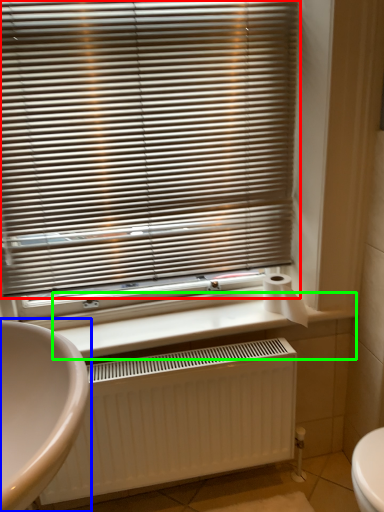
Question: Which object is positioned farthest from window blind (highlighted by a red box)? Select from sink (highlighted by a blue box) and counter top (highlighted by a green box).

Choices:
 (A) sink
 (B) counter top

Answer: (A)